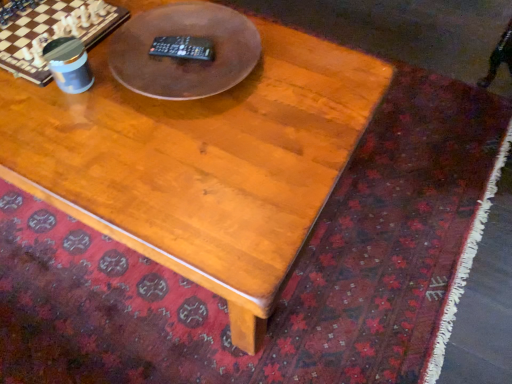
Identify the location of vacant area on top of wooden coffee table at center (from a real-world perspective). (142, 107).